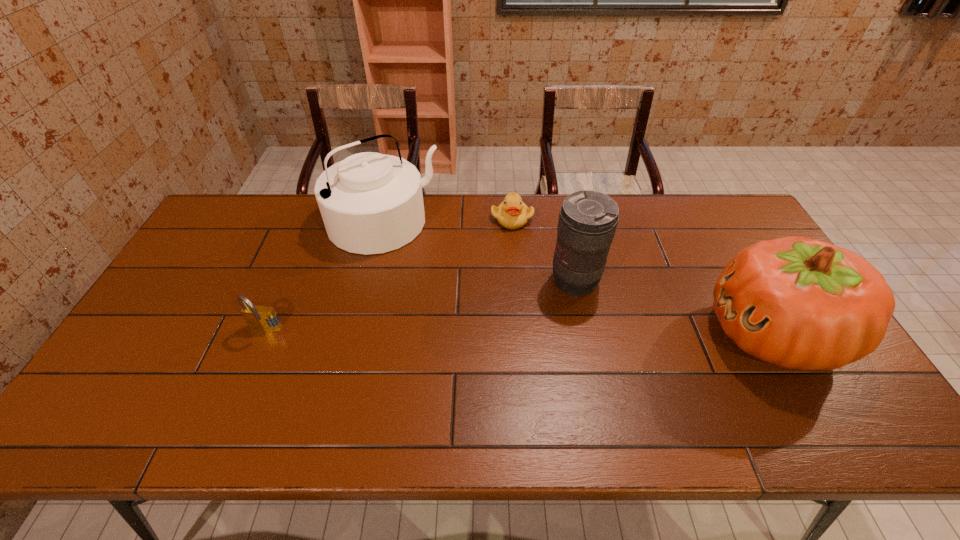
This screenshot has height=540, width=960. I want to click on kettle that is at the far edge, so click(371, 203).

The image size is (960, 540). Find the location of `duckling present at the far edge`. duckling present at the far edge is located at coordinates (512, 213).

The width and height of the screenshot is (960, 540). In order to click on object located in the near edge section of the desktop in this screenshot , I will do `click(799, 303)`.

What are the coordinates of `object that is at the right edge` in the screenshot? It's located at (799, 303).

Locate an element on the screen. The image size is (960, 540). object situated at the near right corner is located at coordinates (799, 303).

I want to click on free space at the far edge of the desktop, so click(x=500, y=227).

The width and height of the screenshot is (960, 540). I want to click on free space at the near edge of the desktop, so click(422, 370).

Where is `blank area at the left edge`? Image resolution: width=960 pixels, height=540 pixels. blank area at the left edge is located at coordinates (204, 248).

In the image, there is a desktop. Where is `vacant space at the far left corner`? Image resolution: width=960 pixels, height=540 pixels. vacant space at the far left corner is located at coordinates (222, 209).

In the image, there is a desktop. Identify the location of free space at the far right corner. (724, 233).